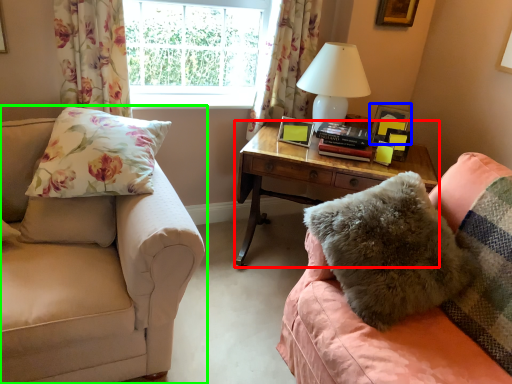
Question: Based on their relative distances, which object is farther from nightstand (highlighted by a red box)? Choose from picture frame (highlighted by a blue box) and studio couch (highlighted by a green box).

Choices:
 (A) picture frame
 (B) studio couch

Answer: (B)